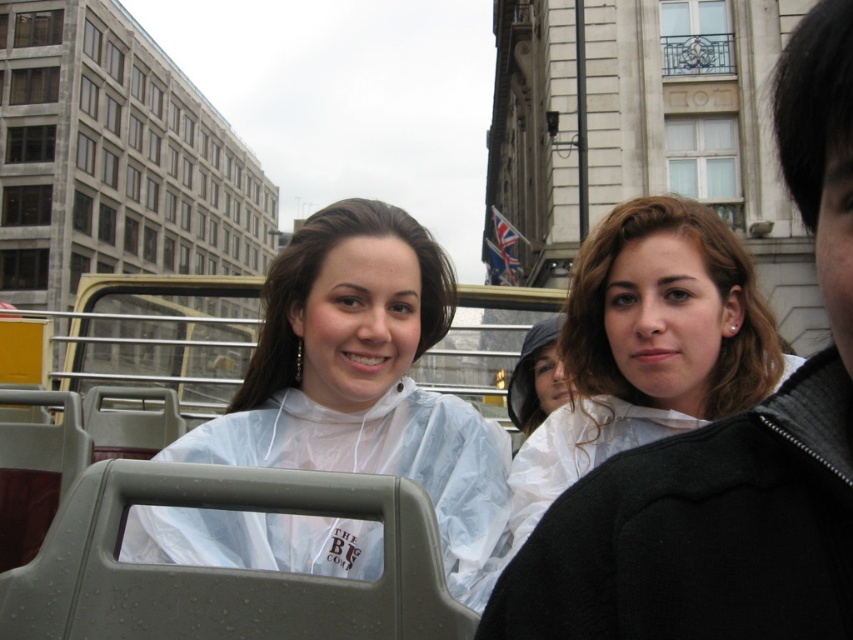
Question: Based on their relative distances, which object is farther from the transparent plastic poncho at center?

Choices:
 (A) transparent plastic raincoat at center
 (B) translucent white raincoat at center

Answer: (A)

Question: Can you confirm if transparent plastic poncho at center is positioned below translucent white raincoat at center?

Choices:
 (A) no
 (B) yes

Answer: (A)

Question: Among these objects, which one is farthest from the camera?

Choices:
 (A) translucent white raincoat at center
 (B) transparent plastic raincoat at center
 (C) transparent plastic poncho at center

Answer: (A)

Question: Can you confirm if transparent plastic raincoat at center is thinner than translucent white raincoat at center?

Choices:
 (A) no
 (B) yes

Answer: (A)

Question: Which point is closer to the camera taking this photo?

Choices:
 (A) (463, 520)
 (B) (683, 252)
 (C) (724, 524)

Answer: (C)

Question: Does transparent plastic poncho at center appear on the left side of translucent white raincoat at center?

Choices:
 (A) yes
 (B) no

Answer: (A)